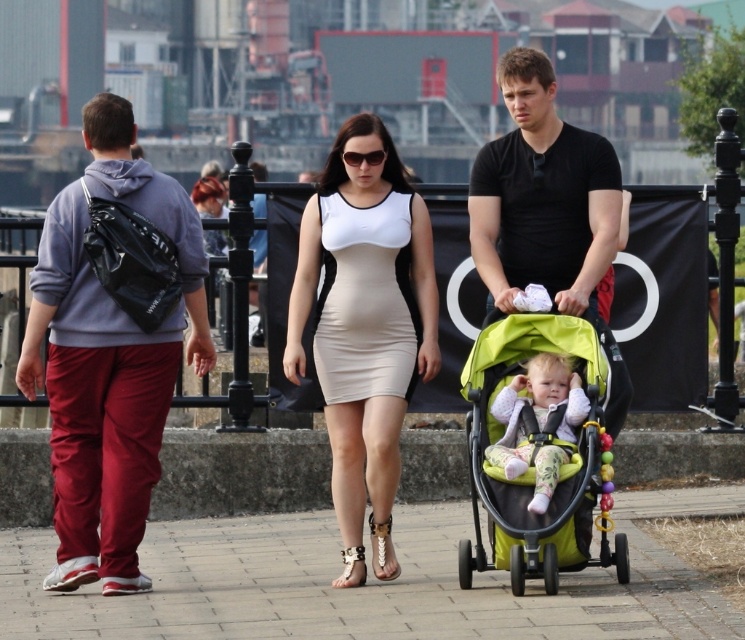
Does beige fabric dress at center have a lesser width compared to matte gray hoodie at left?

Indeed, beige fabric dress at center has a lesser width compared to matte gray hoodie at left.

Between point (320, 264) and point (142, 522), which one is positioned behind?

The point (320, 264) is more distant.

Which is behind, point (326, 177) or point (110, 160)?

Positioned behind is point (326, 177).

Where is `beige fabric dress at center`? The width and height of the screenshot is (745, 640). beige fabric dress at center is located at coordinates (364, 326).

This screenshot has width=745, height=640. What do you see at coordinates (367, 582) in the screenshot?
I see `paved stone pavement at center` at bounding box center [367, 582].

Who is more distant from viewer, (434, 602) or (527, 164)?

The point (527, 164) is more distant.

Image resolution: width=745 pixels, height=640 pixels. Identify the location of paved stone pavement at center. (367, 582).

Does matte gray hoodie at left have a greater height compared to fluffy pink jacket at center?

Yes.

Does point (191, 321) come closer to viewer compared to point (519, 449)?

No, it is not.

Describe the element at coordinates (37, 332) in the screenshot. I see `matte gray hoodie at left` at that location.

Where is `matte gray hoodie at left`? matte gray hoodie at left is located at coordinates point(37,332).